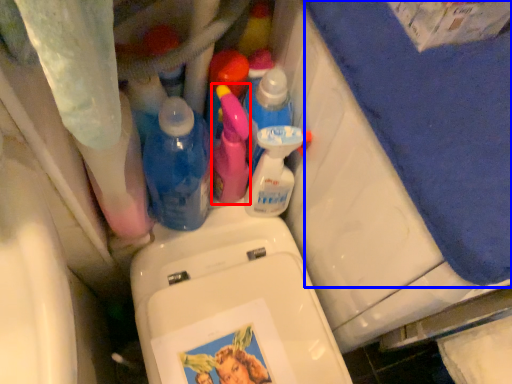
Question: Which point is further to the camera, cleaning product (highlighted by a red box) or bath towel (highlighted by a blue box)?

Choices:
 (A) cleaning product
 (B) bath towel

Answer: (A)